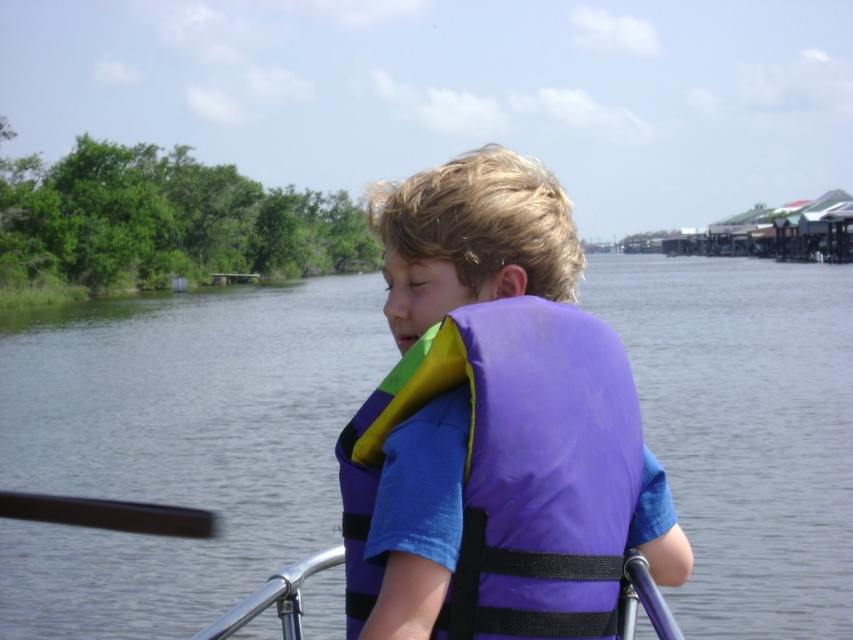
You are a lifeguard on duty and need to ensure the child is wearing a properly sized life vest. The child is wearing the purple life vest at center and the purple fabric life vest at center. Which one is taller?

The purple life vest at center is taller than the purple fabric life vest at center.